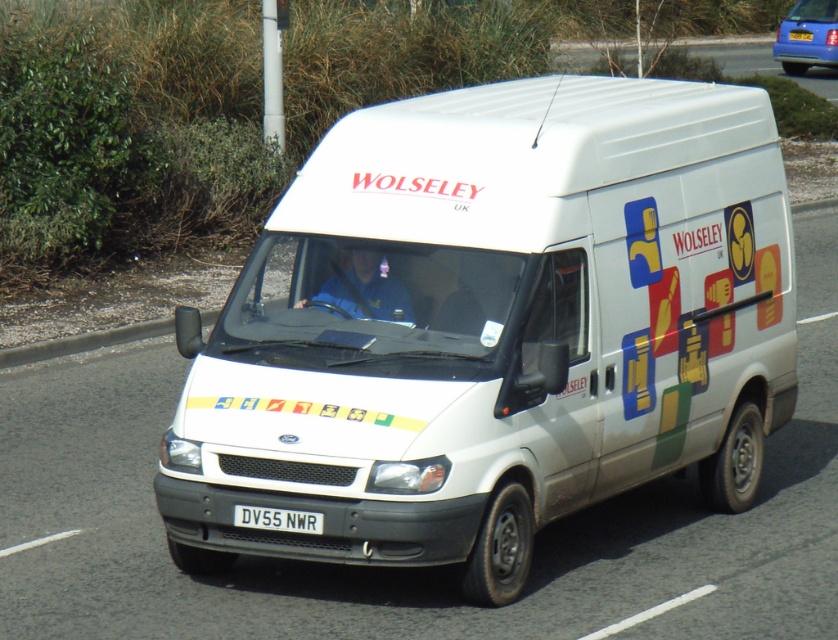
You are a traffic officer observing a white matte van at center with a white plastic license plate at center. Which object is positioned higher in the image?

The white matte van at center is positioned higher than the white plastic license plate at center.

You are a photographer trying to capture the white matte van at center and the white plastic license plate at center in a single shot. Given their sizes, which object will appear bigger in your photo?

The white matte van at center will appear bigger in the photo because it has a larger size compared to the white plastic license plate at center.